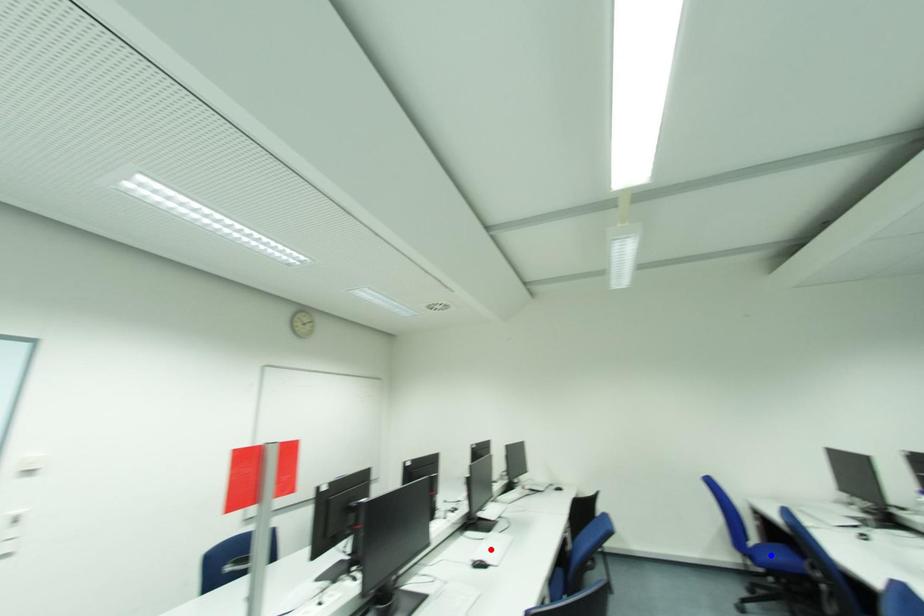
Question: In the image, two points are highlighted. Which point is nearer to the camera? Reply with the corresponding letter.

Choices:
 (A) blue point
 (B) red point

Answer: (A)